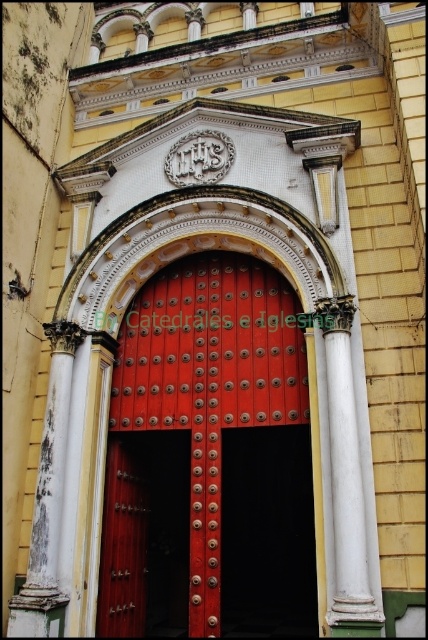
You are an architect assessing the entrance of a building. You need to determine which object, the shiny metal door at center or the white marble column at center, occupies more space in the entrance area. Based on the provided scene description, which one is larger?

The shiny metal door at center has a larger size compared to the white marble column at center, so the shiny metal door at center occupies more space in the entrance area.

You are standing at the entrance of a building and see the white marble column at center and the white weathered column at left. Which column is located higher up?

The white marble column at center is positioned over the white weathered column at left, meaning it is higher up.